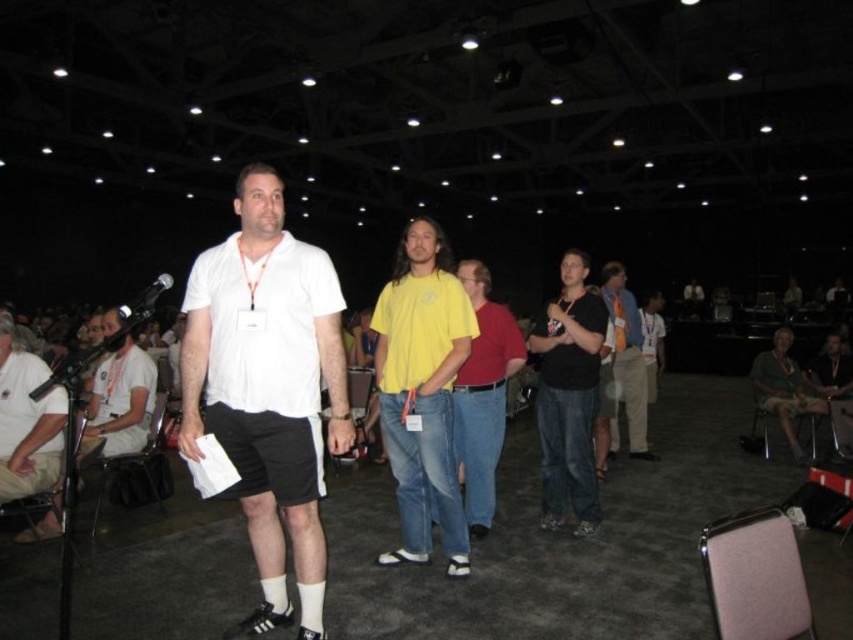
Question: Which point is closer to the camera?

Choices:
 (A) (799, 460)
 (B) (593, 362)
 (C) (42, 444)

Answer: (C)

Question: Which point appears farthest from the camera in this image?

Choices:
 (A) (114, 448)
 (B) (376, 310)
 (C) (494, 349)

Answer: (A)

Question: Can you confirm if white matte t-shirt at center is wider than black metallic microphone at left?

Choices:
 (A) no
 (B) yes

Answer: (A)

Question: From the image, what is the correct spatial relationship of matte yellow shirt at center in relation to matte white shirt at left?

Choices:
 (A) right
 (B) left

Answer: (A)

Question: Is black matte shirt at center further to camera compared to matte yellow shirt at center?

Choices:
 (A) yes
 (B) no

Answer: (A)

Question: Which object is the farthest from the light brown leather chair at lower right?

Choices:
 (A) black matte shirt at center
 (B) black metallic microphone at left

Answer: (B)